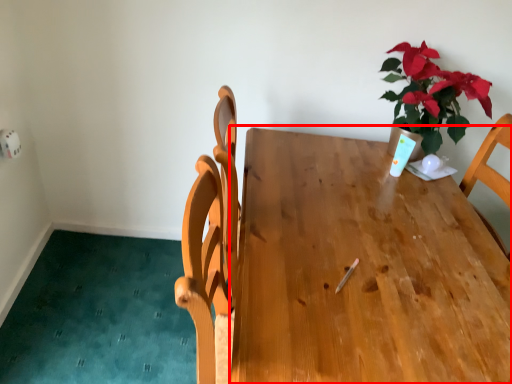
Question: From the image's perspective, considering the relative positions of table (annotated by the red box) and houseplant in the image provided, where is table (annotated by the red box) located with respect to the staircase?

Choices:
 (A) below
 (B) above

Answer: (A)